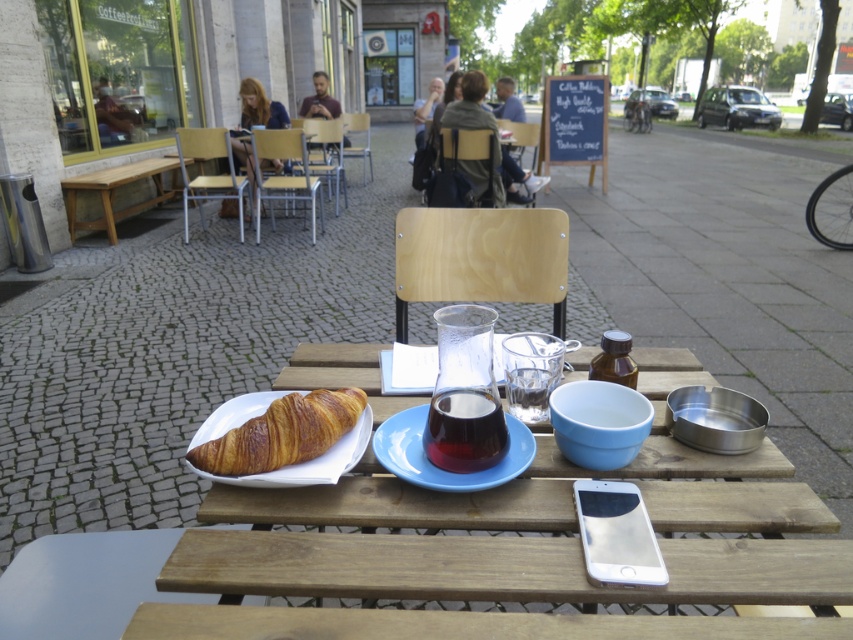
You are planning to host a small gathering and need to seat 4 people. The wooden picnic table at center and the light brown wooden bench at left are available. Which furniture piece can accommodate more guests?

The light brown wooden bench at left is larger than the wooden picnic table at center, so it can accommodate more guests.

You are a customer at the outdoor cafe and want to reach for the translucent glass beverage at center without knocking over the blue matte plate at center. Which object should you move first to create space?

The blue matte plate at center is closer to the viewer than the translucent glass beverage at center. To create space, you should move the blue matte plate at center first since it is nearer to you, allowing easier access to the beverage.